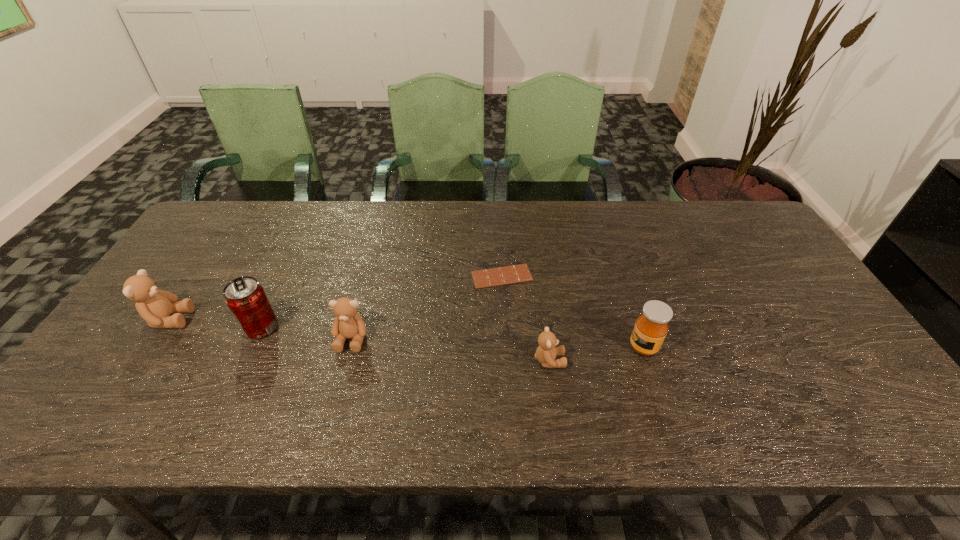
Where is `the leftmost object`? This screenshot has height=540, width=960. the leftmost object is located at coordinates (155, 306).

This screenshot has height=540, width=960. In order to click on the tallest teddy bear in this screenshot , I will do `click(155, 306)`.

In order to click on the fourth object from right to left in this screenshot , I will do `click(348, 324)`.

This screenshot has height=540, width=960. What are the coordinates of `the second teddy bear from left to right` in the screenshot? It's located at (348, 324).

I want to click on the shortest teddy bear, so click(x=546, y=352).

Find the location of `the rightmost teddy bear`. the rightmost teddy bear is located at coordinates (546, 352).

The image size is (960, 540). In order to click on pop soda in this screenshot , I will do `click(246, 299)`.

I want to click on the farthest object, so click(x=511, y=274).

Locate an element on the screen. chocolate bar is located at coordinates (511, 274).

This screenshot has height=540, width=960. What are the coordinates of `honey` in the screenshot? It's located at (651, 327).